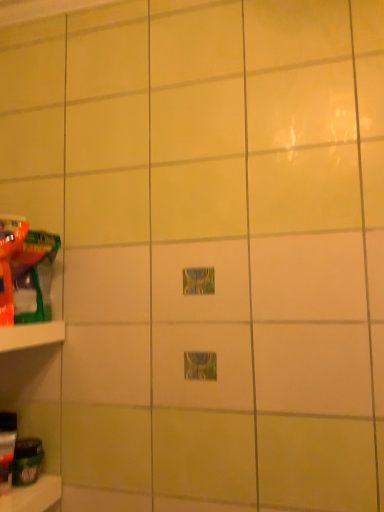
Question: From a real-world perspective, is green matte jar at lower left, which is counted as the first toy, starting from the bottom, positioned under translucent plastic toy at left, the fourth toy when ordered from bottom to top, based on gravity?

Choices:
 (A) no
 (B) yes

Answer: (B)

Question: Is green matte jar at lower left, which is counted as the first toy, starting from the bottom, located outside translucent plastic toy at left, the first toy in the top-to-bottom sequence?

Choices:
 (A) yes
 (B) no

Answer: (A)

Question: Does green matte jar at lower left, which appears as the 4th toy when viewed from the top, have a smaller size compared to translucent plastic toy at left, the fourth toy when ordered from bottom to top?

Choices:
 (A) no
 (B) yes

Answer: (B)

Question: Is green matte jar at lower left, which is counted as the first toy, starting from the bottom, to the left of translucent plastic toy at left, the first toy in the top-to-bottom sequence, from the viewer's perspective?

Choices:
 (A) yes
 (B) no

Answer: (B)

Question: Is the position of green matte jar at lower left, which is counted as the first toy, starting from the bottom, more distant than that of translucent plastic toy at left, the first toy in the top-to-bottom sequence?

Choices:
 (A) no
 (B) yes

Answer: (B)

Question: Is green matte jar at lower left, which appears as the 4th toy when viewed from the top, bigger than translucent plastic toy at left, the fourth toy when ordered from bottom to top?

Choices:
 (A) no
 (B) yes

Answer: (A)

Question: From a real-world perspective, is white plastic shelf at left located higher than translucent plastic bottle at lower left, positioned as the 3th toy in top-to-bottom order?

Choices:
 (A) no
 (B) yes

Answer: (B)

Question: Is white plastic shelf at left smaller than translucent plastic bottle at lower left, positioned as the 3th toy in top-to-bottom order?

Choices:
 (A) yes
 (B) no

Answer: (B)

Question: Considering the relative positions of white plastic shelf at left and translucent plastic bottle at lower left, arranged as the second toy when ordered from the bottom, in the image provided, is white plastic shelf at left behind translucent plastic bottle at lower left, arranged as the second toy when ordered from the bottom,?

Choices:
 (A) yes
 (B) no

Answer: (B)

Question: Would you say white plastic shelf at left is outside translucent plastic bottle at lower left, positioned as the 3th toy in top-to-bottom order?

Choices:
 (A) no
 (B) yes

Answer: (B)

Question: From a real-world perspective, is white plastic shelf at left located beneath translucent plastic bottle at lower left, positioned as the 3th toy in top-to-bottom order?

Choices:
 (A) yes
 (B) no

Answer: (B)

Question: Could you tell me if white plastic shelf at left is turned towards translucent plastic bottle at lower left, positioned as the 3th toy in top-to-bottom order?

Choices:
 (A) yes
 (B) no

Answer: (B)

Question: Can you confirm if white plastic shelf at left is shorter than translucent plastic toy at left, the fourth toy when ordered from bottom to top?

Choices:
 (A) yes
 (B) no

Answer: (A)